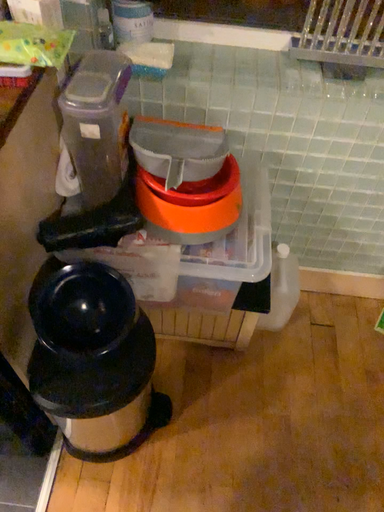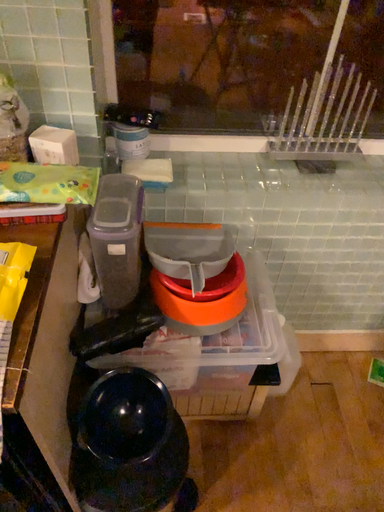
Question: How did the camera likely rotate when shooting the video?

Choices:
 (A) rotated downward
 (B) rotated upward

Answer: (B)